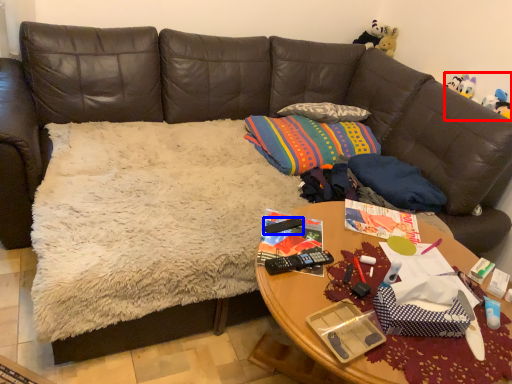
Question: Among these objects, which one is farthest to the camera, toy (highlighted by a red box) or remote control (highlighted by a blue box)?

Choices:
 (A) toy
 (B) remote control

Answer: (A)